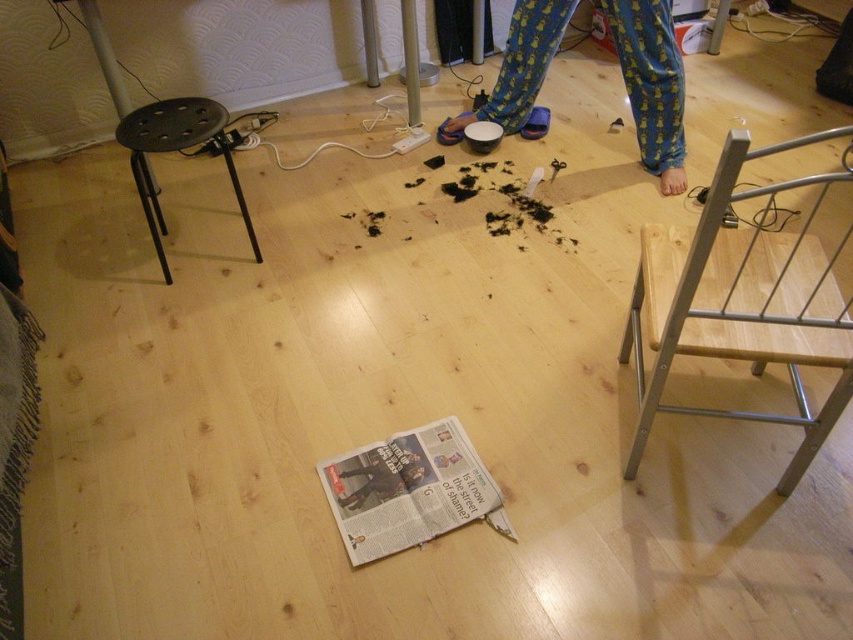
Find the location of `white glossy newspaper at center`. white glossy newspaper at center is located at coordinates (409, 490).

Is white glossy newspaper at center further to camera compared to black plastic stool at left?

No, it is not.

Locate an element on the screen. Image resolution: width=853 pixels, height=640 pixels. white glossy newspaper at center is located at coordinates (409, 490).

Where is `white glossy newspaper at center`? This screenshot has width=853, height=640. white glossy newspaper at center is located at coordinates (409, 490).

Between blue cotton pajama pants at center and dark gray fabric pants at center, which one has more height?

blue cotton pajama pants at center

Can you confirm if blue cotton pajama pants at center is shorter than dark gray fabric pants at center?

No.

Is point (560, 22) positioned after point (378, 468)?

Yes, it is behind point (378, 468).

Where is `blue cotton pajama pants at center`? blue cotton pajama pants at center is located at coordinates pyautogui.click(x=651, y=83).

Measure the distance between point (630, 76) and camera.

A distance of 7.85 feet exists between point (630, 76) and camera.

Between blue cotton pajama pants at center and black plastic stool at left, which one appears on the left side from the viewer's perspective?

black plastic stool at left

The image size is (853, 640). Find the location of `blue cotton pajama pants at center`. blue cotton pajama pants at center is located at coordinates (651, 83).